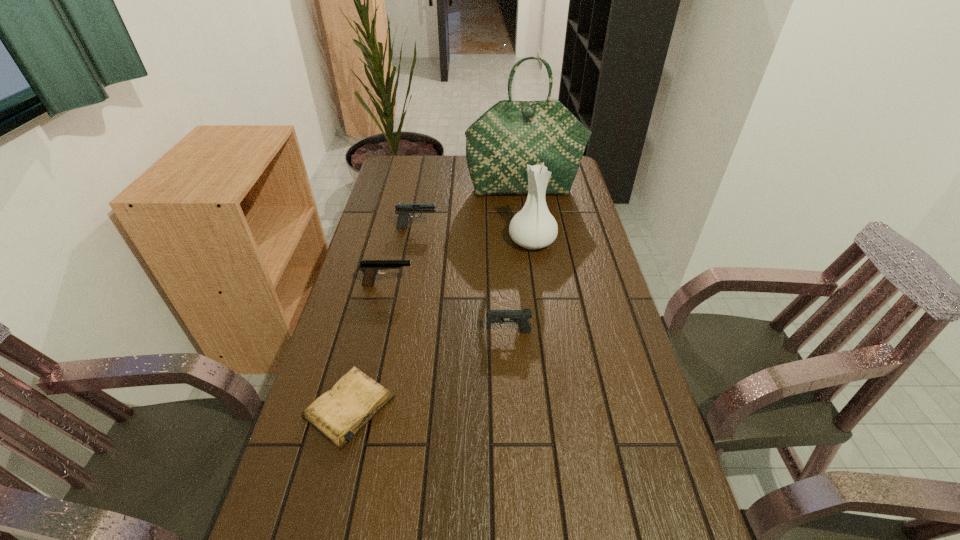
Where is `the farthest object`? The image size is (960, 540). the farthest object is located at coordinates (510, 135).

Image resolution: width=960 pixels, height=540 pixels. Find the location of `the tallest object`. the tallest object is located at coordinates (510, 135).

The image size is (960, 540). What are the coordinates of `vase` in the screenshot? It's located at (533, 227).

Locate an element on the screen. The width and height of the screenshot is (960, 540). the farthest pistol is located at coordinates [402, 209].

Locate an element on the screen. The image size is (960, 540). the third nearest object is located at coordinates (370, 268).

Where is `the rightmost pistol`? the rightmost pistol is located at coordinates (520, 317).

Where is `the nearest pistol`? This screenshot has height=540, width=960. the nearest pistol is located at coordinates (520, 317).

In order to click on the shortest object in this screenshot , I will do `click(338, 414)`.

Image resolution: width=960 pixels, height=540 pixels. Identify the location of the nearest object. (338, 414).

The height and width of the screenshot is (540, 960). Find the location of `vacant space located on the front of the tote bag`. vacant space located on the front of the tote bag is located at coordinates (528, 217).